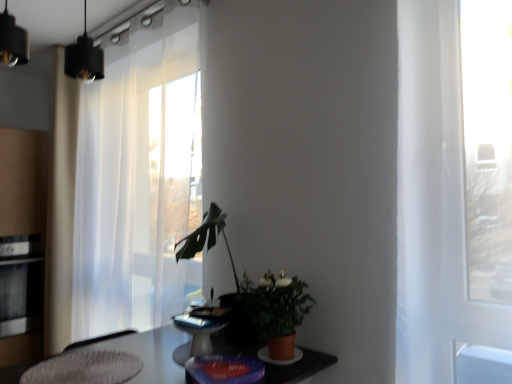
Question: Is white sheer curtain at left thinner than stainless steel oven at left?

Choices:
 (A) yes
 (B) no

Answer: (A)

Question: From a real-world perspective, is white sheer curtain at left under stainless steel oven at left?

Choices:
 (A) yes
 (B) no

Answer: (B)

Question: Does white sheer curtain at left appear on the right side of stainless steel oven at left?

Choices:
 (A) yes
 (B) no

Answer: (A)

Question: Does white sheer curtain at left have a greater height compared to stainless steel oven at left?

Choices:
 (A) no
 (B) yes

Answer: (B)

Question: Would you say stainless steel oven at left is part of white sheer curtain at left's contents?

Choices:
 (A) no
 (B) yes

Answer: (A)

Question: Can you confirm if white sheer curtain at left is smaller than stainless steel oven at left?

Choices:
 (A) no
 (B) yes

Answer: (A)

Question: From a real-world perspective, is stainless steel oven at left located beneath textured gray rug at lower left?

Choices:
 (A) no
 (B) yes

Answer: (A)

Question: Considering the relative positions of stainless steel oven at left and textured gray rug at lower left in the image provided, is stainless steel oven at left to the right of textured gray rug at lower left from the viewer's perspective?

Choices:
 (A) yes
 (B) no

Answer: (B)

Question: Does stainless steel oven at left contain textured gray rug at lower left?

Choices:
 (A) no
 (B) yes

Answer: (A)

Question: From a real-world perspective, is stainless steel oven at left located higher than textured gray rug at lower left?

Choices:
 (A) no
 (B) yes

Answer: (B)

Question: Is stainless steel oven at left facing away from textured gray rug at lower left?

Choices:
 (A) yes
 (B) no

Answer: (B)

Question: Considering the relative sizes of stainless steel oven at left and textured gray rug at lower left in the image provided, is stainless steel oven at left taller than textured gray rug at lower left?

Choices:
 (A) no
 (B) yes

Answer: (B)

Question: Does stainless steel oven at left contain matte terracotta pot at center?

Choices:
 (A) yes
 (B) no

Answer: (B)